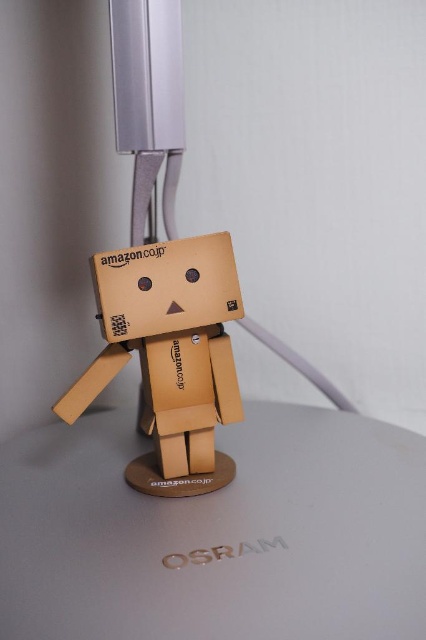
Question: Can you confirm if matte gray table at center is wider than matte cardboard figure at center?

Choices:
 (A) yes
 (B) no

Answer: (A)

Question: Among these objects, which one is farthest from the camera?

Choices:
 (A) matte cardboard figure at center
 (B) matte gray table at center

Answer: (A)

Question: Is matte gray table at center to the right of matte cardboard figure at center from the viewer's perspective?

Choices:
 (A) no
 (B) yes

Answer: (B)

Question: Which point appears farthest from the camera in this image?

Choices:
 (A) (253, 500)
 (B) (158, 401)

Answer: (B)

Question: From the image, what is the correct spatial relationship of matte gray table at center in relation to matte cardboard figure at center?

Choices:
 (A) left
 (B) right

Answer: (B)